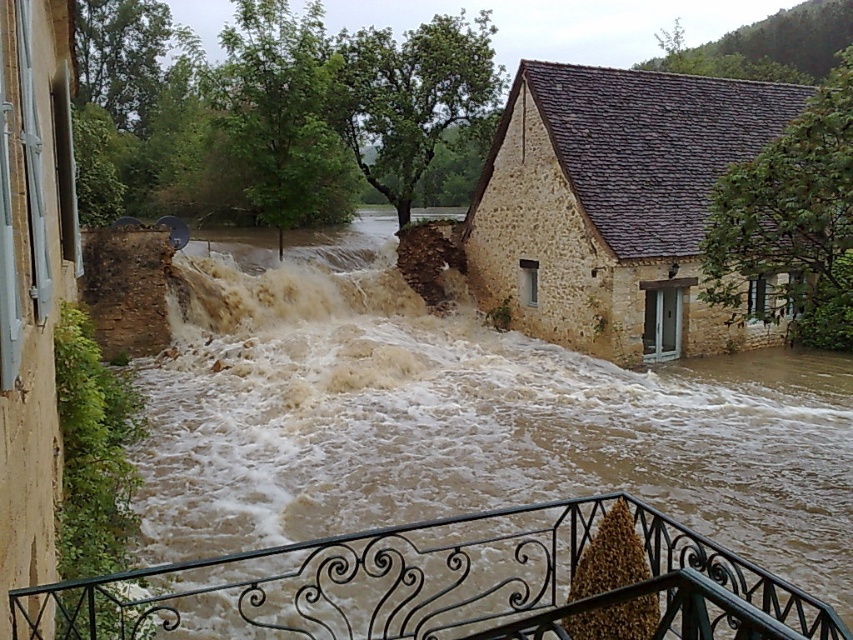
Question: Does brown muddy water at center appear over black wrought iron at lower center?

Choices:
 (A) no
 (B) yes

Answer: (B)

Question: Does brown muddy water at center appear over black wrought iron at lower center?

Choices:
 (A) yes
 (B) no

Answer: (A)

Question: Is brown muddy water at center positioned at the back of black wrought iron at lower center?

Choices:
 (A) no
 (B) yes

Answer: (A)